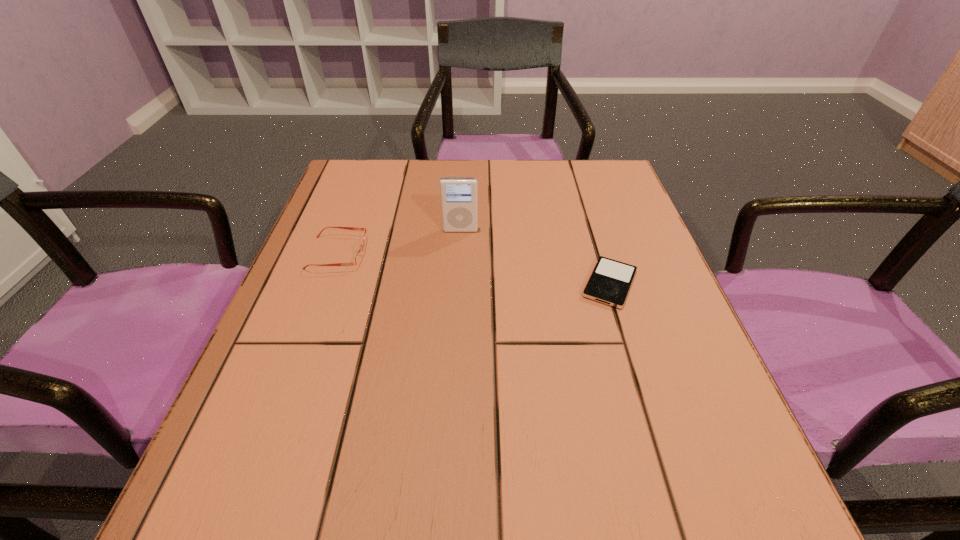
This screenshot has width=960, height=540. I want to click on object present at the right edge, so click(610, 281).

In the image, there is a desktop. Identify the location of blank space at the far edge. (527, 179).

Image resolution: width=960 pixels, height=540 pixels. In order to click on free spot at the near edge of the desktop in this screenshot , I will do point(596,534).

Locate an element on the screen. The width and height of the screenshot is (960, 540). free point at the left edge is located at coordinates click(369, 262).

Image resolution: width=960 pixels, height=540 pixels. Identify the location of free point at the right edge. (580, 256).

Image resolution: width=960 pixels, height=540 pixels. In the image, there is a desktop. In order to click on vacant space at the far left corner in this screenshot , I will do `click(366, 186)`.

In the image, there is a desktop. Where is `vacant space at the near left corner`? vacant space at the near left corner is located at coordinates (210, 519).

Image resolution: width=960 pixels, height=540 pixels. I want to click on free space at the far right corner of the desktop, so click(569, 187).

At what (x,y) coordinates should I click in order to perform the action: click on free space between the shortest object and the second tallest object. Please return your answer as a coordinate pair (x, y). Looking at the image, I should click on (474, 268).

Identify the location of free spot between the second tallest object and the taller iPod. tap(399, 241).